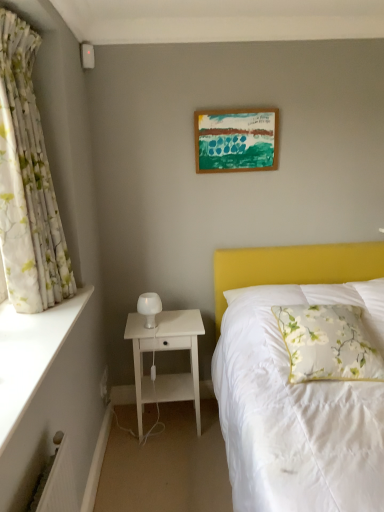
The width and height of the screenshot is (384, 512). Identify the location of free space on the front side of white wood nightstand at lower left. (172, 472).